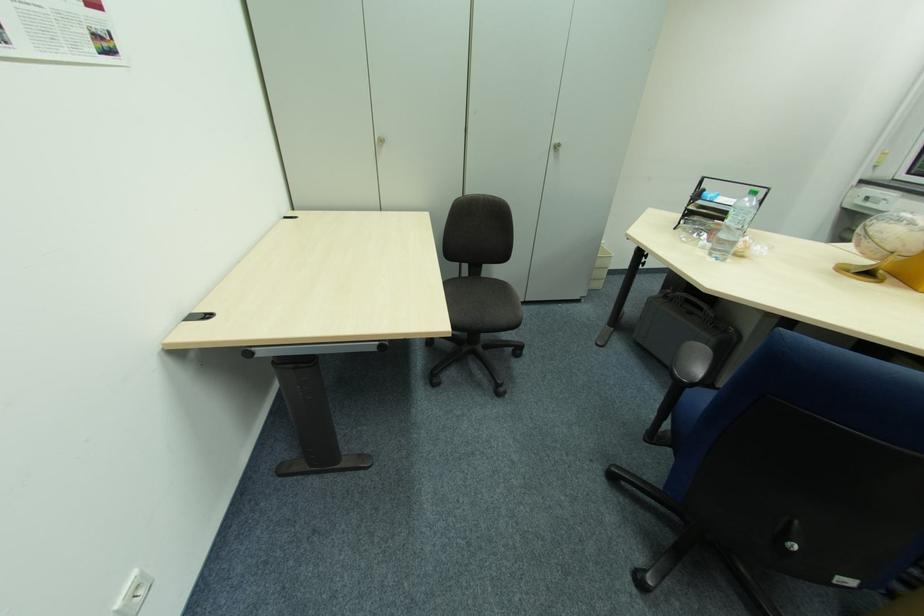
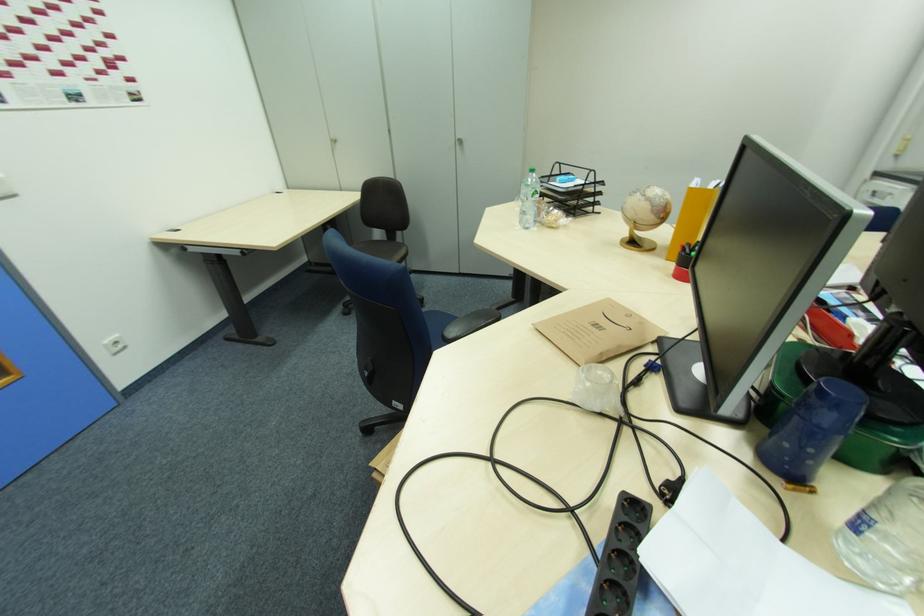
Question: What movement of the cameraman would produce the second image?

Choices:
 (A) Left
 (B) Right
 (C) Forward
 (D) Backward

Answer: (B)